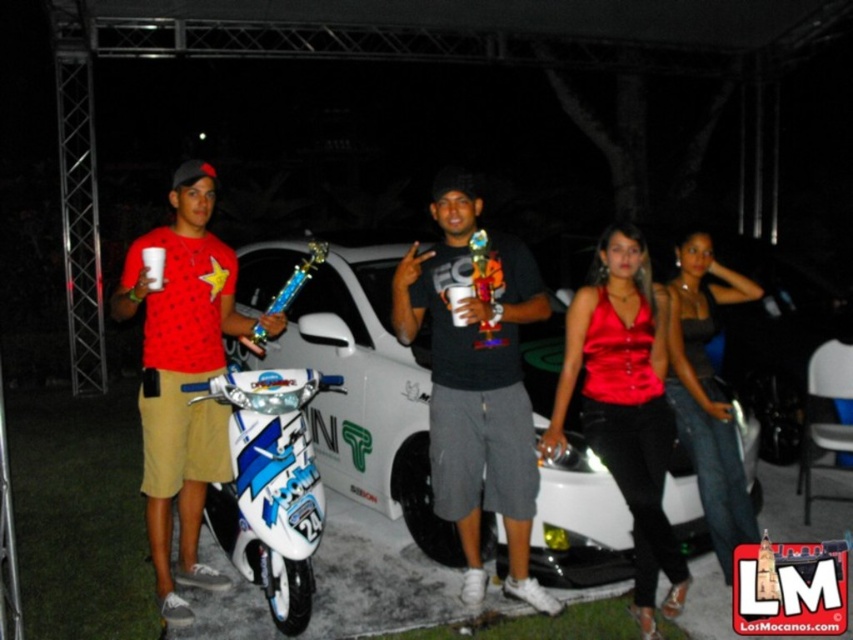
In the scene shown: You are a photographer setting up for a group photo. You have to place a new decorative item between the white glossy scooter at center and the shiny satin top at center. Based on their current positions, which object should the new item be placed to the left of?

The new decorative item should be placed to the left of the shiny satin top at center because the white glossy scooter at center is already on its left side.

You are standing in front of the group of people in the nighttime scene. There are two points marked in the image. Which point, point (518, 385) or point (700, 316), is closer to you?

Point (518, 385) is closer to the viewer than point (700, 316).